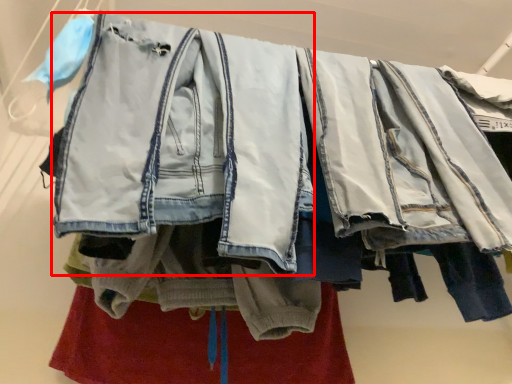
Question: From the image's perspective, what is the correct spatial relationship of denim jacket (annotated by the red box) in relation to underclothes?

Choices:
 (A) above
 (B) below

Answer: (A)